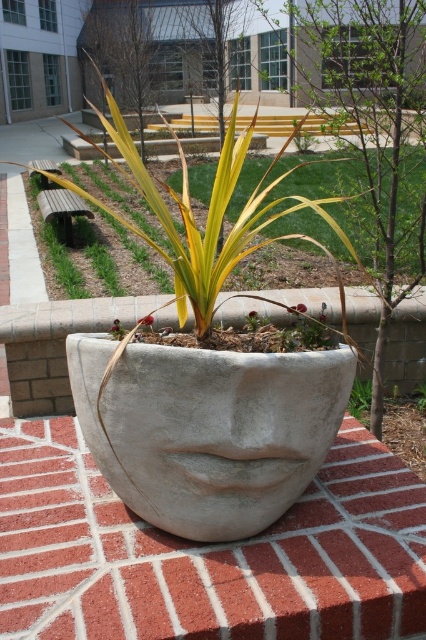
From the picture: You are standing in front of the planter and want to touch the white concrete face at center and the concrete planter at center. Which one can you reach first without moving your position?

You can reach the white concrete face at center first because it is closer to you than the concrete planter at center.

You are standing in front of the artistic planter and want to place a small decoration at point A and point B. If point A is point [405,628] and point B is point [230,292], which point is closer to you?

Point A is in front of point B, so point A is closer to you.